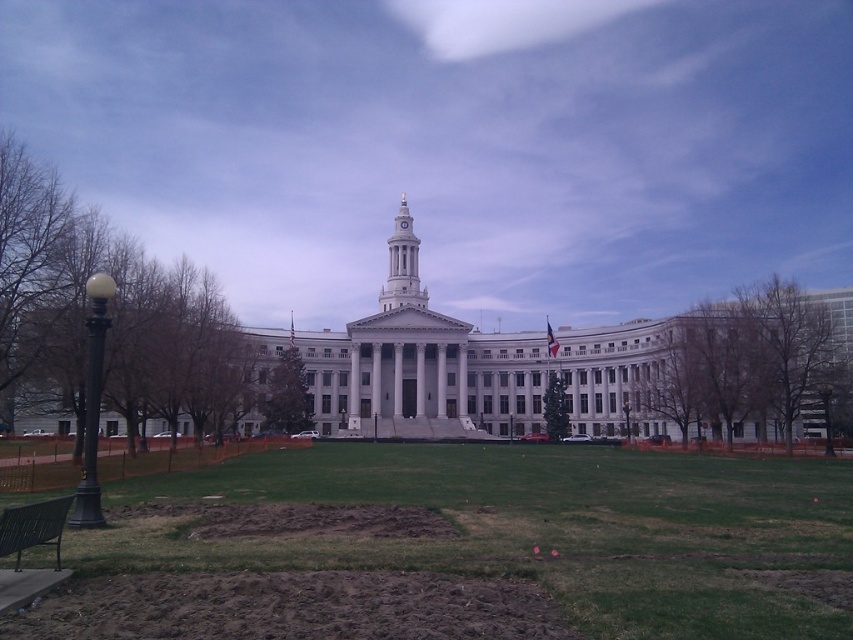
Who is higher up, metallic green bench at lower left or gold metallic spire at center?

gold metallic spire at center

You are a GUI agent. You are given a task and a screenshot of the screen. Output one action in this format:
    pyautogui.click(x=<x>, y=<y>)
    Task: Click on the metallic green bench at lower left
    This screenshot has height=640, width=853.
    Given the screenshot: What is the action you would take?
    pyautogui.click(x=33, y=528)

Locate an element on the screen. The width and height of the screenshot is (853, 640). metallic green bench at lower left is located at coordinates (33, 528).

You are a GUI agent. You are given a task and a screenshot of the screen. Output one action in this format:
    pyautogui.click(x=<x>, y=<y>)
    Task: Click on the metallic green bench at lower left
    
    Given the screenshot: What is the action you would take?
    pyautogui.click(x=33, y=528)

Which is more to the right, green grass at center or black polished lamp post at left?

Positioned to the right is green grass at center.

Between green grass at center and black polished lamp post at left, which one has less height?

green grass at center

Does point (392, 563) lie behind point (90, 355)?

No, it is in front of (90, 355).

Find the location of a particular element. The image size is (853, 640). green grass at center is located at coordinates (465, 548).

Looking at this image, is black polished lamp post at left further to camera compared to gold metallic spire at center?

No.

Based on the photo, is black polished lamp post at left to the right of gold metallic spire at center from the viewer's perspective?

No, black polished lamp post at left is not to the right of gold metallic spire at center.

Locate an element on the screen. The width and height of the screenshot is (853, 640). black polished lamp post at left is located at coordinates (91, 403).

The width and height of the screenshot is (853, 640). Identify the location of black polished lamp post at left. (91, 403).